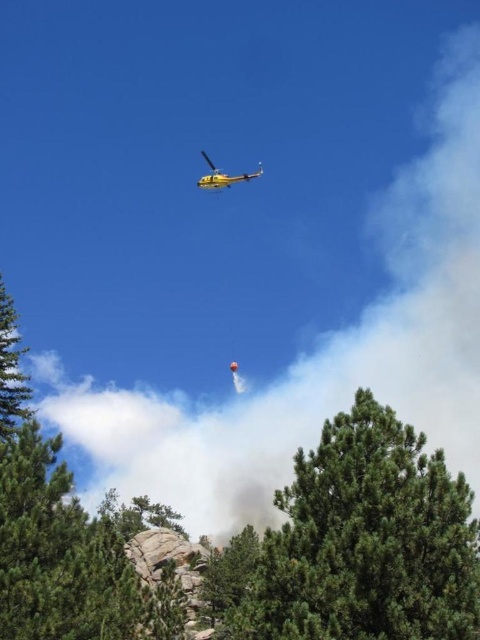
Question: Which object is farther from the camera taking this photo?

Choices:
 (A) green matte tree at left
 (B) green matte tree at center
 (C) green textured tree at center

Answer: (A)

Question: Does green matte tree at center have a smaller size compared to green matte tree at left?

Choices:
 (A) yes
 (B) no

Answer: (B)

Question: Is green textured tree at center bigger than green matte tree at center?

Choices:
 (A) yes
 (B) no

Answer: (A)

Question: In this image, where is green textured tree at center located relative to green matte tree at center?

Choices:
 (A) left
 (B) right

Answer: (B)

Question: Among these objects, which one is farthest from the camera?

Choices:
 (A) green textured tree at center
 (B) green matte tree at center

Answer: (B)

Question: Which point is closer to the camera?

Choices:
 (A) (0, 294)
 (B) (6, 486)

Answer: (B)